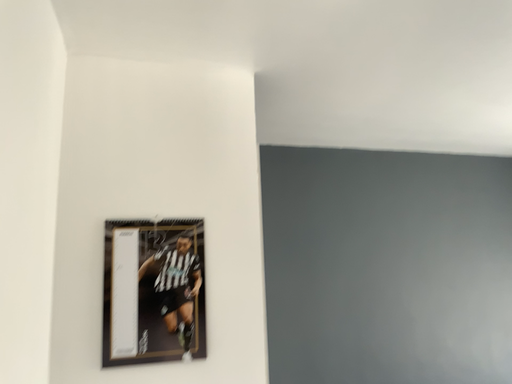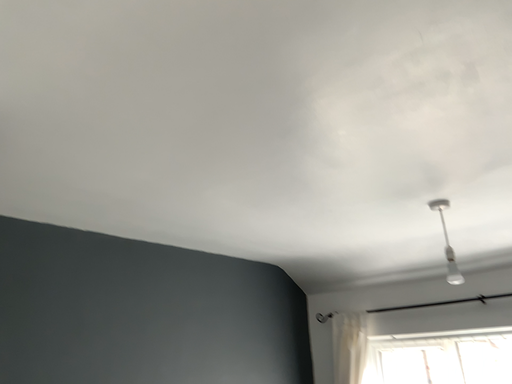
Question: Which way did the camera rotate in the video?

Choices:
 (A) rotated right
 (B) rotated left

Answer: (A)